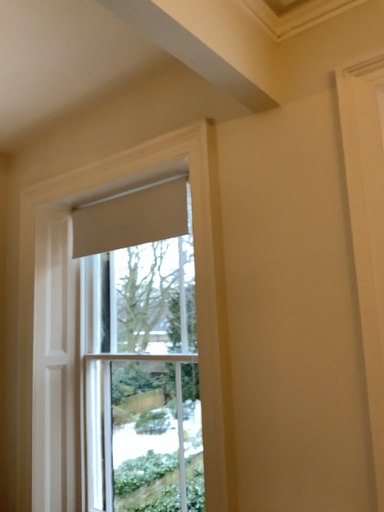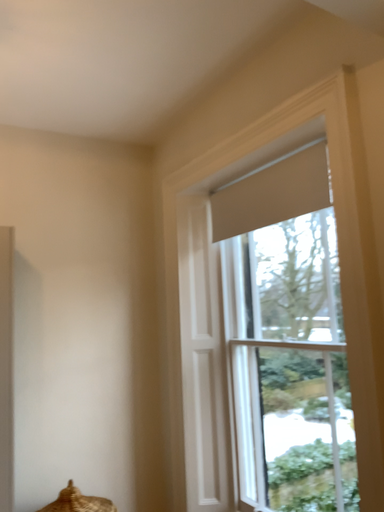
Question: How did the camera likely rotate when shooting the video?

Choices:
 (A) rotated left
 (B) rotated right

Answer: (A)